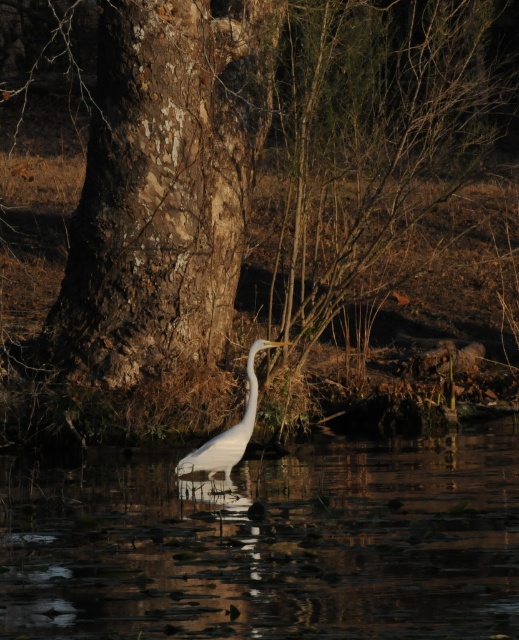
You are standing at the point marked by the coordinates point (163, 186) in the image. What is directly beneath your feet?

The point (163, 186) is directly on the rough bark tree trunk at center.